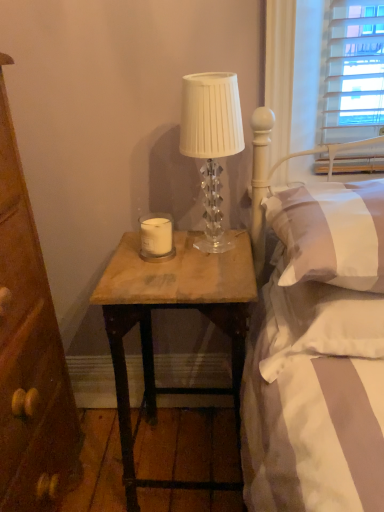
Question: Are white matte candle at center and white soft pillow at upper right, which is the 2th pillow from bottom to top, far apart?

Choices:
 (A) yes
 (B) no

Answer: (B)

Question: Is white matte candle at center oriented towards white soft pillow at upper right, which is the 2th pillow from bottom to top?

Choices:
 (A) yes
 (B) no

Answer: (B)

Question: Is white matte candle at center smaller than white soft pillow at upper right, which is the 2th pillow from bottom to top?

Choices:
 (A) no
 (B) yes

Answer: (B)

Question: Is the position of white matte candle at center less distant than that of white soft pillow at upper right, the first pillow when ordered from top to bottom?

Choices:
 (A) no
 (B) yes

Answer: (A)

Question: From the image's perspective, would you say white matte candle at center is shown under white soft pillow at upper right, which is the 2th pillow from bottom to top?

Choices:
 (A) yes
 (B) no

Answer: (B)

Question: Does white matte candle at center have a greater width compared to white soft pillow at upper right, which is the 2th pillow from bottom to top?

Choices:
 (A) no
 (B) yes

Answer: (A)

Question: Would you say white matte candle at center is a long distance from white soft pillow at right, the 1th pillow positioned from the bottom?

Choices:
 (A) yes
 (B) no

Answer: (B)

Question: Is white soft pillow at right, the 1th pillow positioned from the bottom, surrounded by white matte candle at center?

Choices:
 (A) no
 (B) yes

Answer: (A)

Question: Can you confirm if white matte candle at center is positioned to the right of white soft pillow at right, the 1th pillow positioned from the bottom?

Choices:
 (A) yes
 (B) no

Answer: (B)

Question: Does white matte candle at center appear on the left side of white soft pillow at right, the 2th pillow in the top-to-bottom sequence?

Choices:
 (A) no
 (B) yes

Answer: (B)

Question: Does white matte candle at center have a greater width compared to white soft pillow at right, the 2th pillow in the top-to-bottom sequence?

Choices:
 (A) no
 (B) yes

Answer: (A)

Question: Is white matte candle at center next to white soft pillow at right, the 1th pillow positioned from the bottom?

Choices:
 (A) no
 (B) yes

Answer: (A)

Question: Is white soft pillow at right, the 2th pillow in the top-to-bottom sequence, positioned with its back to white soft pillow at upper right, which is the 2th pillow from bottom to top?

Choices:
 (A) no
 (B) yes

Answer: (A)